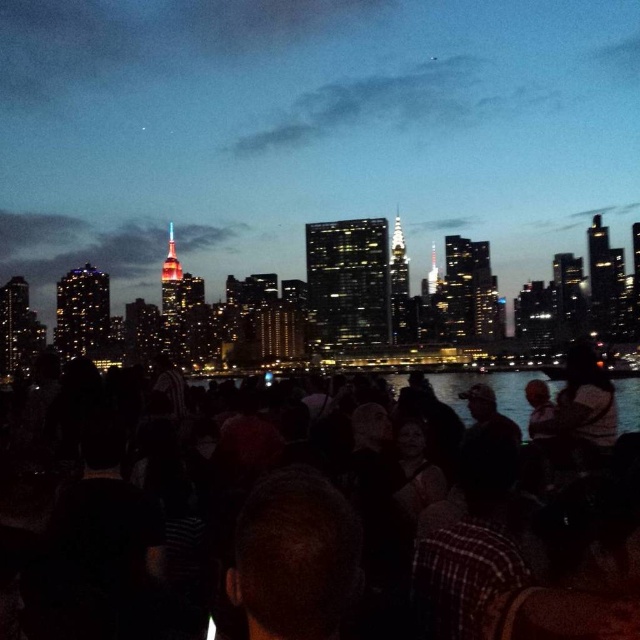
You are standing in the bustling urban scene at dusk. There are two points marked in the image. The first point is at coordinates point [522,390] and the second is at point [513,380]. Which point is closer to you?

Point [522,390] is in front of point [513,380], so it is closer to you.

You are a photographer trying to capture the Empire State Building in the background through the transparent water at center and the black matte crowd at center. Which object is closer to the camera, making it harder to see the building clearly?

The black matte crowd at center is closer to the camera than the transparent water at center, so it obstructs the view of the Empire State Building more.